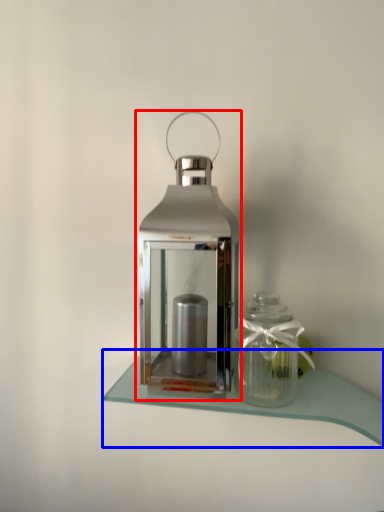
Question: Which point is further to the camera, lantern (highlighted by a red box) or table (highlighted by a blue box)?

Choices:
 (A) lantern
 (B) table

Answer: (B)